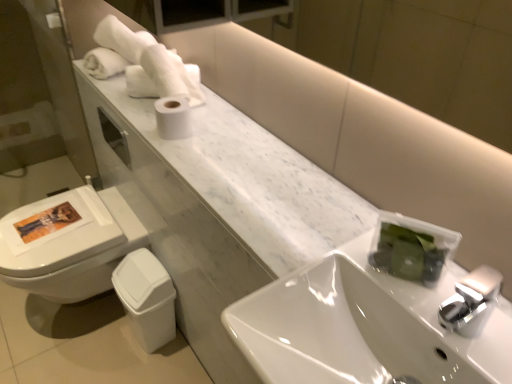
You are a GUI agent. You are given a task and a screenshot of the screen. Output one action in this format:
    pyautogui.click(x=<x>, y=<y>)
    Task: Click on the vacant space behind white matte toilet paper at center
    
    Given the screenshot: What is the action you would take?
    pyautogui.click(x=185, y=112)